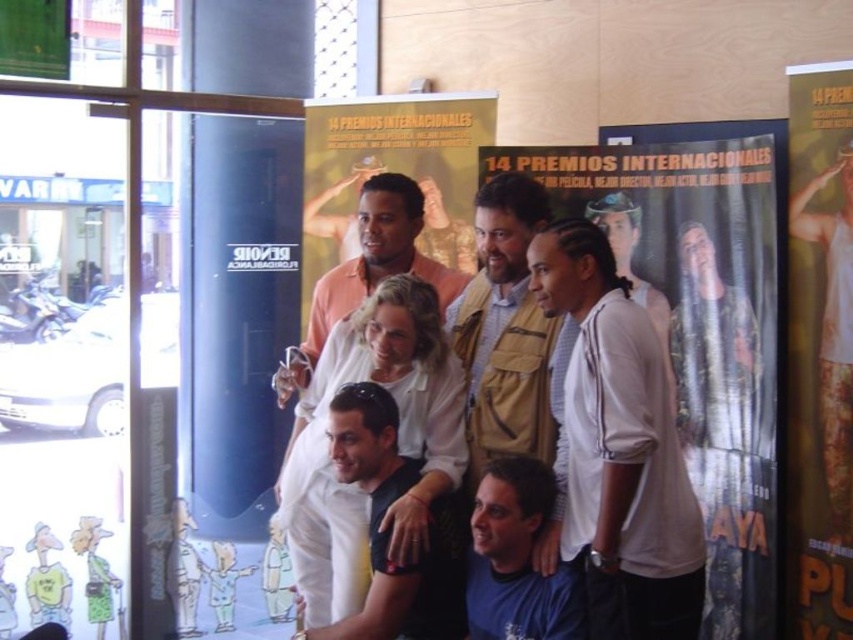
Does white cotton shirt at upper right appear over beige textured vest at center?

Actually, white cotton shirt at upper right is below beige textured vest at center.

Which is behind, point (585, 538) or point (482, 262)?

Positioned behind is point (482, 262).

Image resolution: width=853 pixels, height=640 pixels. I want to click on white cotton shirt at upper right, so click(x=619, y=448).

Can you confirm if white fabric poster at right is taller than matte peach shirt at center?

Correct, white fabric poster at right is much taller as matte peach shirt at center.

Is point (827, 483) farther from camera compared to point (306, 330)?

That is False.

Where is `white fabric poster at right`? The width and height of the screenshot is (853, 640). white fabric poster at right is located at coordinates (820, 348).

The image size is (853, 640). In order to click on white fabric poster at right in this screenshot , I will do [820, 348].

Does white fabric poster at right lie behind blue fabric shirt at center?

Yes, it is behind blue fabric shirt at center.

Who is taller, white fabric poster at right or blue fabric shirt at center?

With more height is white fabric poster at right.

What do you see at coordinates (820, 348) in the screenshot? This screenshot has width=853, height=640. I see `white fabric poster at right` at bounding box center [820, 348].

Identify the location of white fabric poster at right. This screenshot has width=853, height=640. (820, 348).